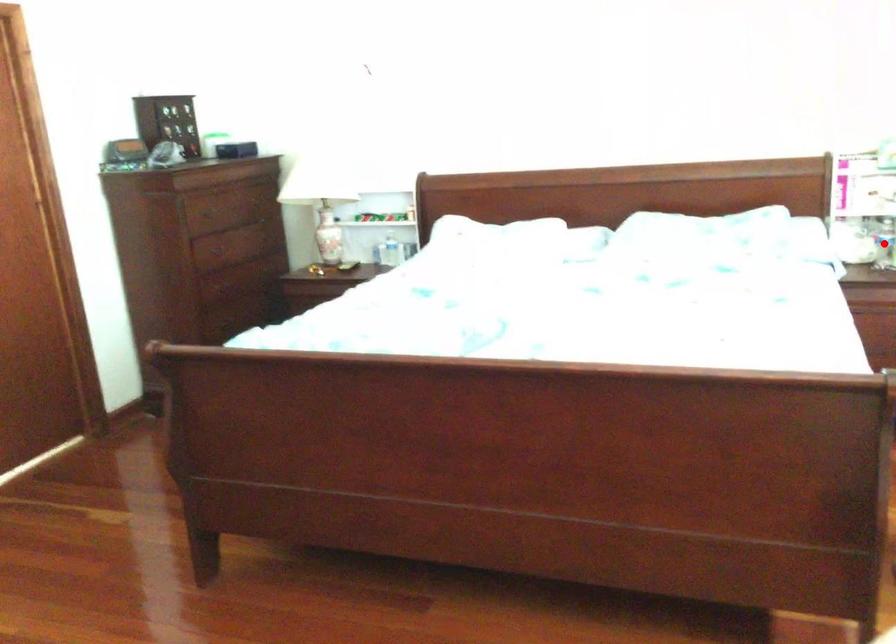
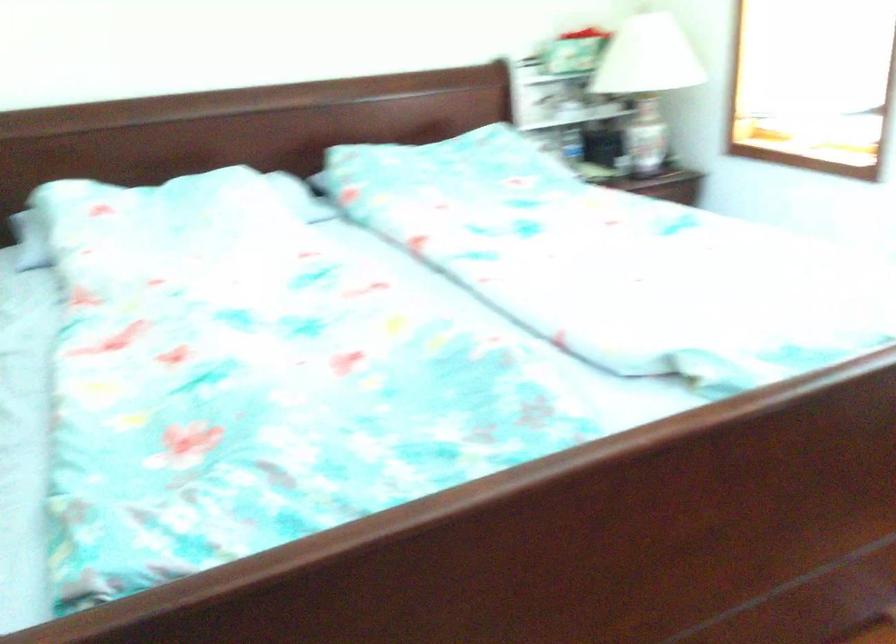
Question: I am providing you with two images of the same scene from different viewpoints. A red point is marked on the first image. Can you still see the location of the red point in image 2?

Choices:
 (A) Yes
 (B) No

Answer: (B)